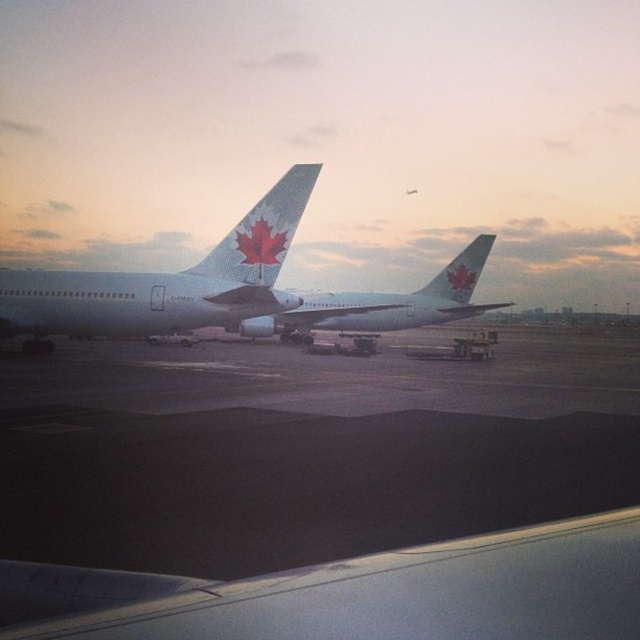
Question: Which object is closer to the camera taking this photo?

Choices:
 (A) white matte airplane at left
 (B) matte white tail at center
 (C) matte white airplane at center

Answer: (A)

Question: Is white matte airplane at left to the right of matte white airplane at center from the viewer's perspective?

Choices:
 (A) yes
 (B) no

Answer: (B)

Question: Is white matte airplane at left closer to the viewer compared to matte white tail at center?

Choices:
 (A) yes
 (B) no

Answer: (A)

Question: Based on their relative distances, which object is farther from the matte white airplane at center?

Choices:
 (A) white matte airplane at left
 (B) matte white tail at center

Answer: (B)

Question: Considering the real-world distances, which object is farthest from the matte white airplane at center?

Choices:
 (A) matte white tail at center
 (B) white matte airplane at left

Answer: (A)

Question: Considering the relative positions of matte white airplane at center and matte white tail at center in the image provided, where is matte white airplane at center located with respect to matte white tail at center?

Choices:
 (A) below
 (B) above

Answer: (A)